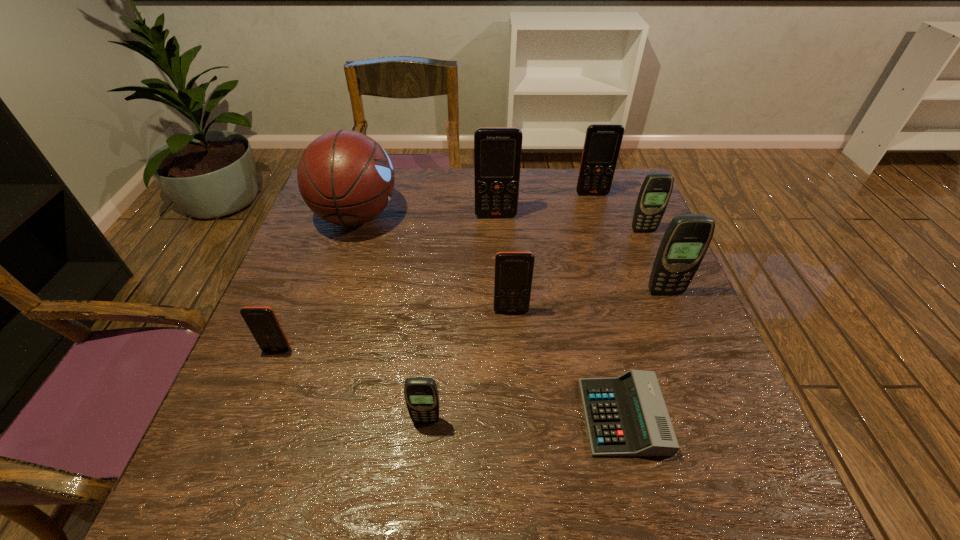
Where is `calculator located in the right edge section of the desktop`? The height and width of the screenshot is (540, 960). calculator located in the right edge section of the desktop is located at coordinates (626, 415).

The width and height of the screenshot is (960, 540). I want to click on object that is at the far left corner, so click(345, 177).

Locate an element on the screen. Image resolution: width=960 pixels, height=540 pixels. object situated at the far right corner is located at coordinates (602, 143).

I want to click on object at the near right corner, so click(626, 415).

Image resolution: width=960 pixels, height=540 pixels. I want to click on free space at the far edge, so click(x=556, y=186).

Where is `vacant space at the near edge of the desktop`? The width and height of the screenshot is (960, 540). vacant space at the near edge of the desktop is located at coordinates (528, 465).

You are a GUI agent. You are given a task and a screenshot of the screen. Output one action in this format:
    pyautogui.click(x=<x>, y=<y>)
    Task: Click on the free space at the left edge of the desktop
    
    Given the screenshot: What is the action you would take?
    pyautogui.click(x=321, y=262)

The height and width of the screenshot is (540, 960). Find the location of `vacant space at the right edge of the desktop`. vacant space at the right edge of the desktop is located at coordinates (670, 323).

This screenshot has height=540, width=960. What are the coordinates of `free space at the far right corner of the desktop` in the screenshot? It's located at (616, 184).

Image resolution: width=960 pixels, height=540 pixels. I want to click on empty space between the fifth nearest object and the shortest object, so click(x=644, y=354).